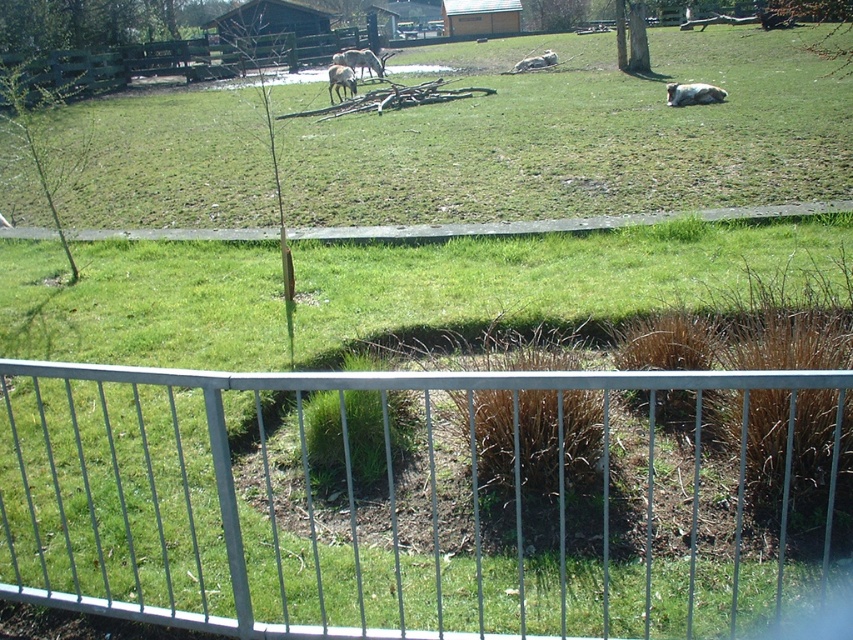
Does silver metallic fence at lower center lie behind white fur horse at center?

No.

Does point (753, 429) come in front of point (376, 76)?

Yes.

The width and height of the screenshot is (853, 640). What are the coordinates of `silver metallic fence at lower center` in the screenshot? It's located at (422, 499).

Which is more to the right, white woolly sheep at upper center or white fur horse at center?

Positioned to the right is white woolly sheep at upper center.

Between point (701, 84) and point (331, 58), which one is positioned behind?

The point (331, 58) is more distant.

Which is in front, point (677, 106) or point (364, 64)?

Point (677, 106) is more forward.

At what (x,y) coordinates should I click in order to perform the action: click on white woolly sheep at upper center. Please return your answer as a coordinate pair (x, y). Looking at the image, I should click on (693, 93).

Does silver metallic fence at lower center have a lesser width compared to white woolly sheep at center?

No, silver metallic fence at lower center is not thinner than white woolly sheep at center.

Who is taller, silver metallic fence at lower center or white woolly sheep at center?

silver metallic fence at lower center is taller.

Who is more forward, (170, 400) or (351, 72)?

Positioned in front is point (170, 400).

You are a GUI agent. You are given a task and a screenshot of the screen. Output one action in this format:
    pyautogui.click(x=<x>, y=<y>)
    Task: Click on the silver metallic fence at lower center
    The height and width of the screenshot is (640, 853).
    Given the screenshot: What is the action you would take?
    pyautogui.click(x=422, y=499)